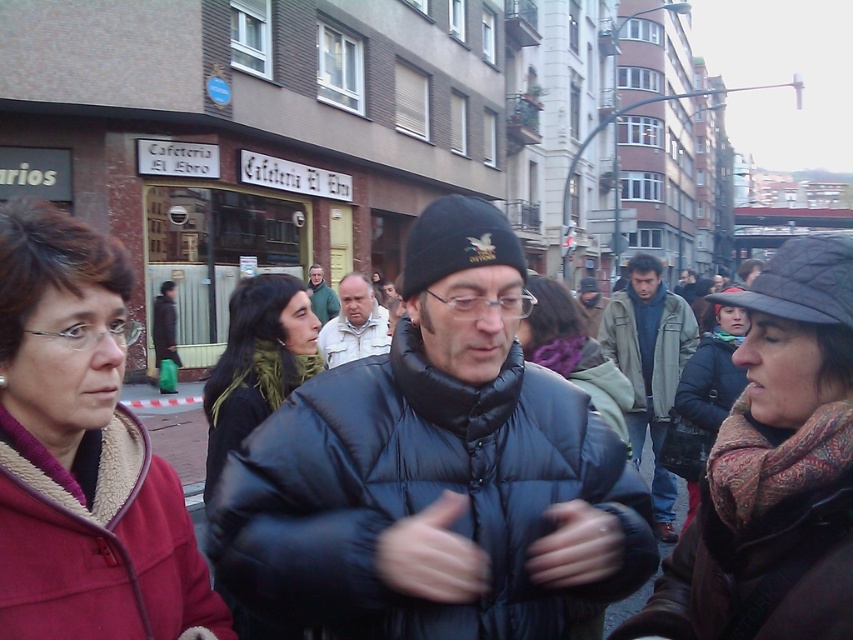
Question: Is purple scarf at center positioned behind matte black jacket at center?

Choices:
 (A) yes
 (B) no

Answer: (B)

Question: Which of the following is the farthest from the observer?

Choices:
 (A) (627, 330)
 (B) (735, 365)
 (C) (592, 400)

Answer: (A)

Question: Considering the real-world distances, which object is farthest from the white fabric jacket at center?

Choices:
 (A) green scarf at center
 (B) patterned scarf at center

Answer: (B)

Question: Is the position of black puffy jacket at center less distant than that of dark blue puffer jacket at center?

Choices:
 (A) no
 (B) yes

Answer: (B)

Question: Can you confirm if maroon fleece jacket at center is positioned below matte black jacket at center?

Choices:
 (A) no
 (B) yes

Answer: (B)

Question: Among these objects, which one is farthest from the camera?

Choices:
 (A) matte black jacket at center
 (B) greenish-gray jacket at center

Answer: (A)